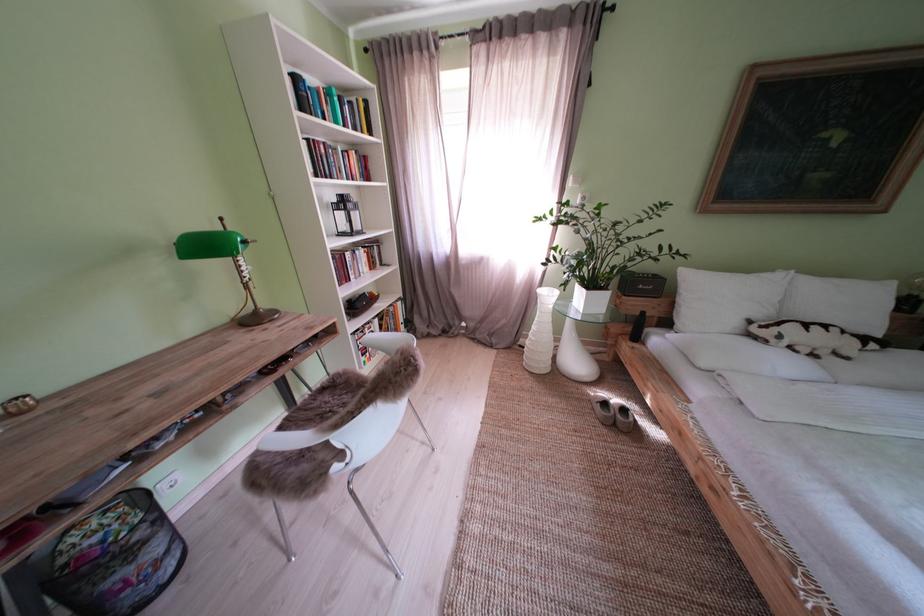
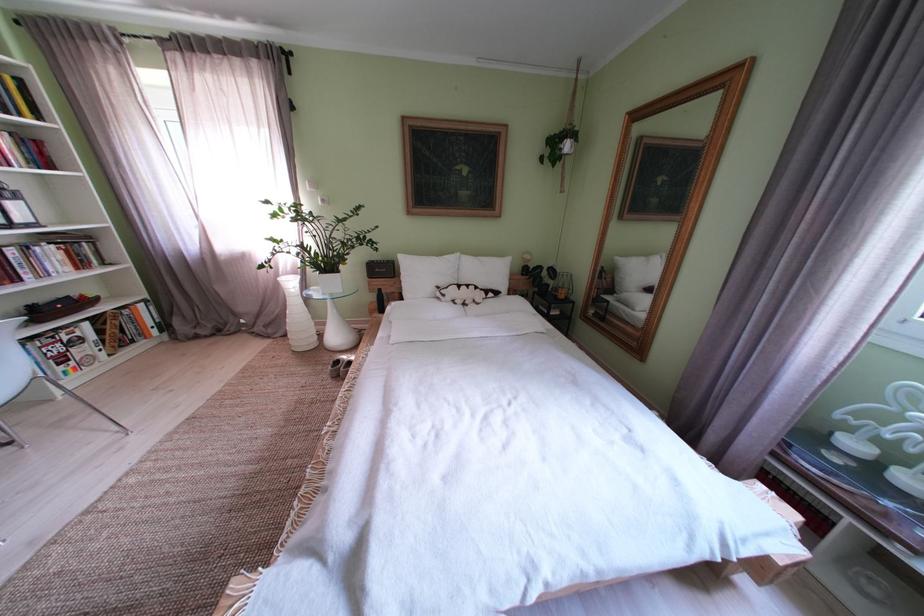
Where in the second image is the point corresponding to [792,342] from the first image?

(455, 301)